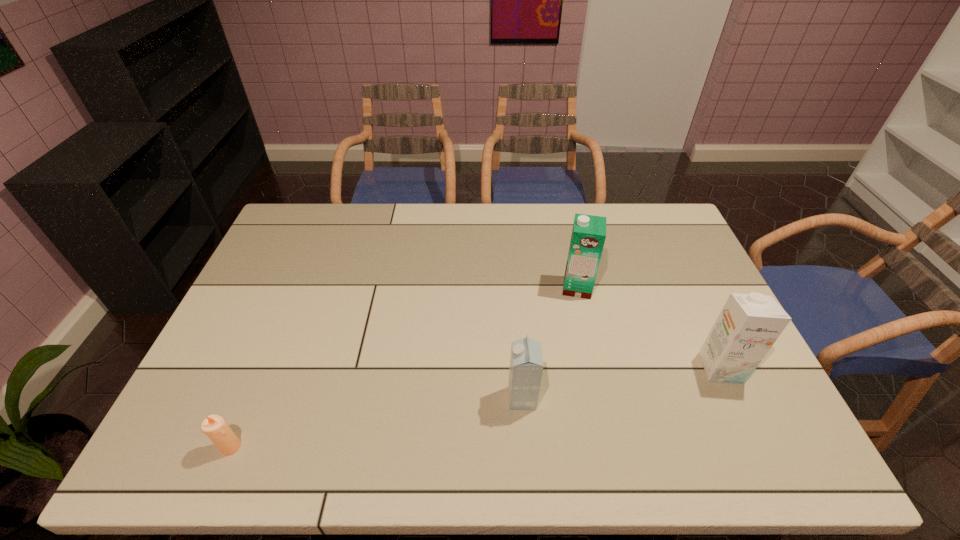
Find the location of `the second carton from right to left`. the second carton from right to left is located at coordinates (588, 236).

Where is `the farthest carton`? This screenshot has height=540, width=960. the farthest carton is located at coordinates (588, 236).

Locate an element on the screen. The height and width of the screenshot is (540, 960). the second nearest carton is located at coordinates (749, 324).

This screenshot has height=540, width=960. I want to click on the second farthest object, so click(x=749, y=324).

Identify the location of the second nearest object. Image resolution: width=960 pixels, height=540 pixels. (526, 362).

Identify the location of the leftmost carton. The height and width of the screenshot is (540, 960). (526, 362).

Identify the location of the leftmost object. This screenshot has height=540, width=960. (214, 426).

Locate an element on the screen. The image size is (960, 540). candle is located at coordinates (214, 426).

The width and height of the screenshot is (960, 540). Identify the location of vacant area located on the back of the farthest carton. (564, 228).

You are a GUI agent. You are given a task and a screenshot of the screen. Output one action in this format:
    pyautogui.click(x=<x>, y=<y>)
    Task: Click on the free point located on the left of the rightmost object
    
    Given the screenshot: What is the action you would take?
    pyautogui.click(x=603, y=368)